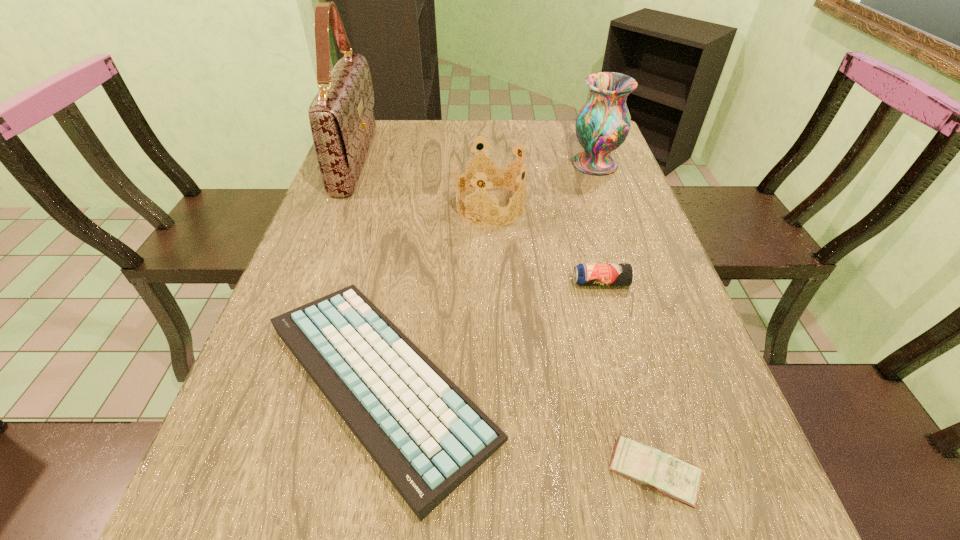
Image resolution: width=960 pixels, height=540 pixels. Identify the location of handbag. (342, 122).

Identify the location of the second tallest object. (602, 125).

This screenshot has width=960, height=540. Find the location of `crown`. crown is located at coordinates (491, 171).

Locate an element on the screen. Image resolution: width=960 pixels, height=540 pixels. beer can is located at coordinates (584, 274).

Where is `computer keyboard`? The height and width of the screenshot is (540, 960). computer keyboard is located at coordinates (427, 436).

Locate an element on the screen. diary is located at coordinates (665, 473).

Locate an element on the screen. This screenshot has width=960, height=540. vacant space located on the front of the handbag with the clasp is located at coordinates (393, 160).

You are a GUI agent. You are given a task and a screenshot of the screen. Output one action in this format:
    pyautogui.click(x=<x>, y=<y>)
    Task: Click on the free spot located 0.070m on the back of the vase
    
    Given the screenshot: What is the action you would take?
    pyautogui.click(x=587, y=140)

This screenshot has height=540, width=960. Identify the location of free spot located on the front of the third tallest object. (494, 339).

Identify the location of free space located on the front of the beer can. The width and height of the screenshot is (960, 540). [x=643, y=437].